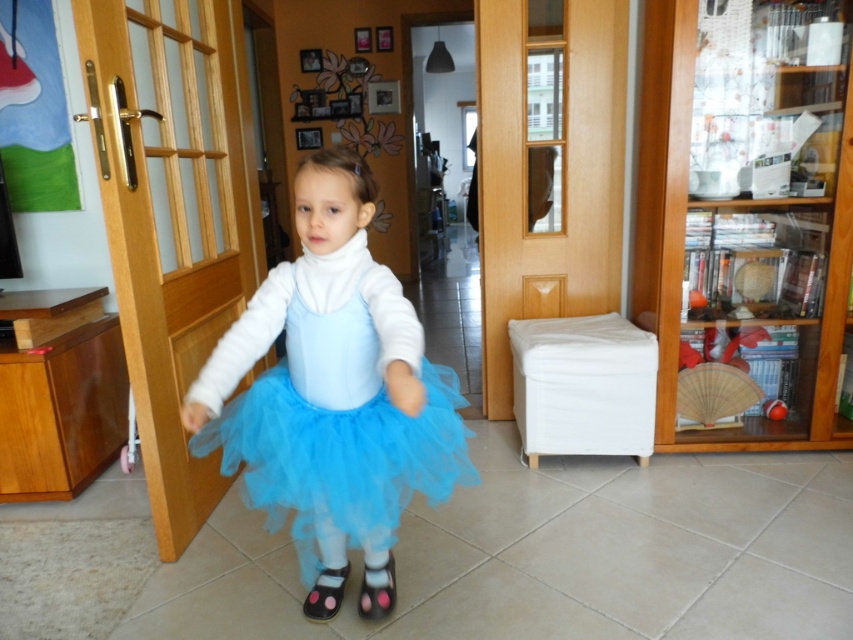
This screenshot has height=640, width=853. In order to click on light blue tulle tutu at center in this screenshot , I will do `click(332, 385)`.

What do you see at coordinates (332, 385) in the screenshot? I see `light blue tulle tutu at center` at bounding box center [332, 385].

Locate an element on the screen. light blue tulle tutu at center is located at coordinates (332, 385).

Does light blue tulle tutu at center appear over matte blue tulle skirt at center?

Correct, light blue tulle tutu at center is located above matte blue tulle skirt at center.

Can you confirm if light blue tulle tutu at center is bigger than matte blue tulle skirt at center?

Yes.

Find the location of a particular element. Image resolution: width=853 pixels, height=640 pixels. light blue tulle tutu at center is located at coordinates (332, 385).

Locate an element on the screen. light blue tulle tutu at center is located at coordinates (332, 385).

Can you confirm if light blue tulle tutu at center is positioned below tulle skirt at center?

Actually, light blue tulle tutu at center is above tulle skirt at center.

Can you confirm if light blue tulle tutu at center is positioned above tulle skirt at center?

Correct, light blue tulle tutu at center is located above tulle skirt at center.

At what (x,y) coordinates should I click in order to perform the action: click on light blue tulle tutu at center. Please return your answer as a coordinate pair (x, y). Looking at the image, I should click on (332, 385).